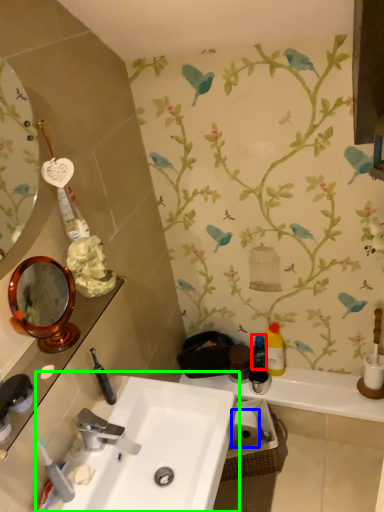
Question: Estimate the real-world distances between objects in this image. Which object is closer to mouthwash (highlighted by a red box), toilet paper (highlighted by a blue box) or sink (highlighted by a green box)?

Choices:
 (A) toilet paper
 (B) sink

Answer: (A)